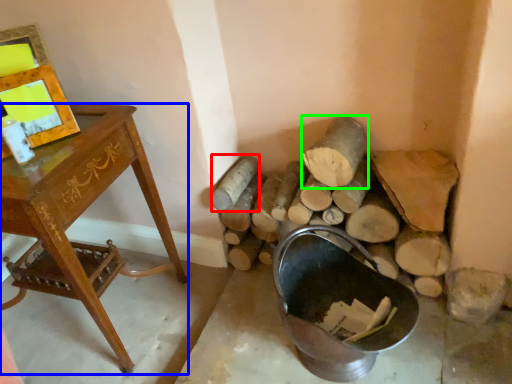
Question: Estimate the real-world distances between objects in this image. Which object is farther from log (highlighted by a red box), desk (highlighted by a blue box) or log (highlighted by a green box)?

Choices:
 (A) desk
 (B) log

Answer: (A)